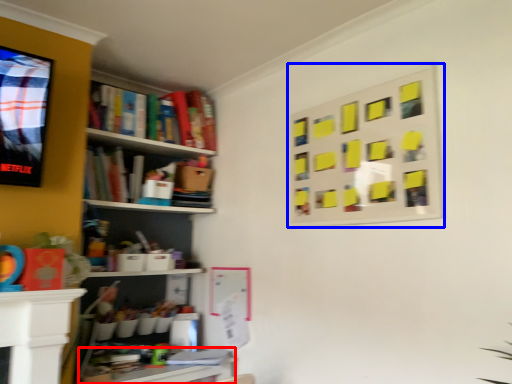
Question: Among these objects, which one is nearest to the camera, table (highlighted by a red box) or bulletin board (highlighted by a blue box)?

Choices:
 (A) table
 (B) bulletin board

Answer: (B)